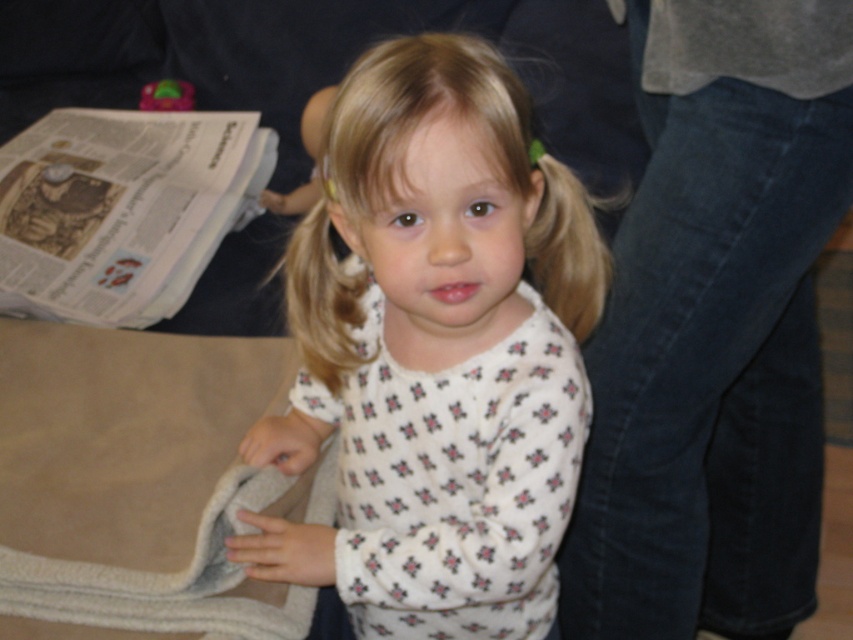
Can you confirm if white printed shirt at center is thinner than white printed newspaper at upper left?

Yes, white printed shirt at center is thinner than white printed newspaper at upper left.

This screenshot has width=853, height=640. Describe the element at coordinates (436, 353) in the screenshot. I see `white printed shirt at center` at that location.

You are a GUI agent. You are given a task and a screenshot of the screen. Output one action in this format:
    pyautogui.click(x=<x>, y=<y>)
    Task: Click on the white printed shirt at center
    This screenshot has width=853, height=640.
    Given the screenshot: What is the action you would take?
    pyautogui.click(x=436, y=353)